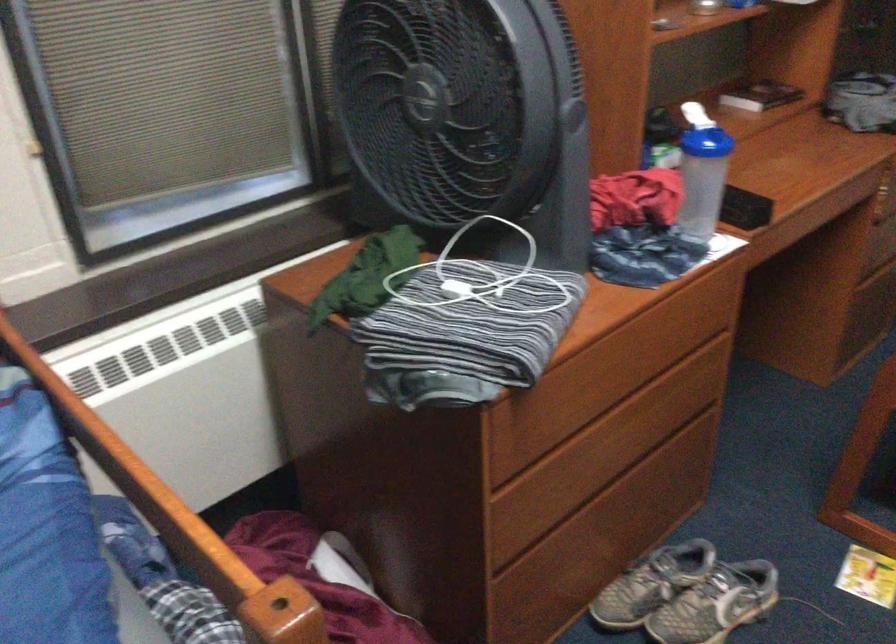
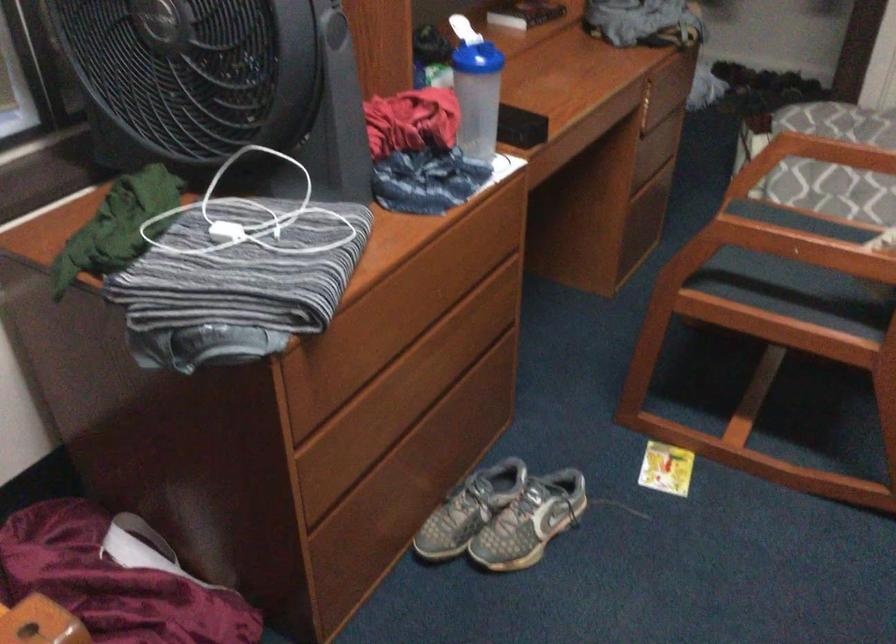
Where in the second image is the point corresponding to point (693, 116) from the first image?

(462, 29)